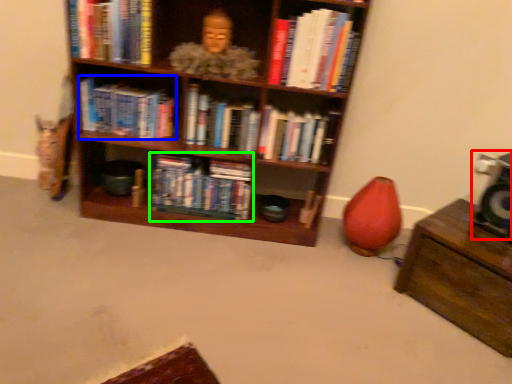
Question: Considering the real-world distances, which object is closest to speaker (highlighted by a red box)? book (highlighted by a blue box) or book (highlighted by a green box).

Choices:
 (A) book
 (B) book

Answer: (B)